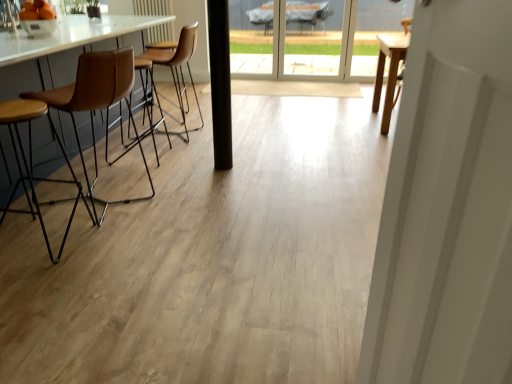
Question: Considering the relative sizes of transparent glass screen door at upper center and brown leather stool at left, positioned as the first chair in front-to-back order, in the image provided, is transparent glass screen door at upper center shorter than brown leather stool at left, positioned as the first chair in front-to-back order,?

Choices:
 (A) yes
 (B) no

Answer: (B)

Question: Is transparent glass screen door at upper center not within brown leather stool at left, positioned as the first chair in front-to-back order?

Choices:
 (A) no
 (B) yes

Answer: (B)

Question: Is the position of transparent glass screen door at upper center less distant than that of brown leather stool at left, which ranks as the 3th chair in back-to-front order?

Choices:
 (A) yes
 (B) no

Answer: (B)

Question: Does transparent glass screen door at upper center have a greater width compared to brown leather stool at left, which ranks as the 3th chair in back-to-front order?

Choices:
 (A) yes
 (B) no

Answer: (B)

Question: Is transparent glass screen door at upper center further to the viewer compared to brown leather stool at left, which ranks as the 3th chair in back-to-front order?

Choices:
 (A) no
 (B) yes

Answer: (B)

Question: From the image's perspective, is transparent glass screen door at upper center beneath brown leather stool at left, positioned as the first chair in front-to-back order?

Choices:
 (A) yes
 (B) no

Answer: (B)

Question: Is brown leather stool at left, positioned as the first chair in front-to-back order, facing towards transparent glass screen door at upper center?

Choices:
 (A) yes
 (B) no

Answer: (B)

Question: Can you confirm if brown leather stool at left, which ranks as the 3th chair in back-to-front order, is bigger than transparent glass screen door at upper center?

Choices:
 (A) no
 (B) yes

Answer: (B)

Question: Are brown leather stool at left, which ranks as the 3th chair in back-to-front order, and transparent glass screen door at upper center located far from each other?

Choices:
 (A) no
 (B) yes

Answer: (B)

Question: Considering the relative positions of brown leather stool at left, which ranks as the 3th chair in back-to-front order, and transparent glass screen door at upper center in the image provided, is brown leather stool at left, which ranks as the 3th chair in back-to-front order, to the right of transparent glass screen door at upper center from the viewer's perspective?

Choices:
 (A) yes
 (B) no

Answer: (B)

Question: Considering the relative sizes of brown leather stool at left, which ranks as the 3th chair in back-to-front order, and transparent glass screen door at upper center in the image provided, is brown leather stool at left, which ranks as the 3th chair in back-to-front order, thinner than transparent glass screen door at upper center?

Choices:
 (A) no
 (B) yes

Answer: (A)

Question: Can you confirm if brown leather stool at left, positioned as the first chair in front-to-back order, is taller than transparent glass screen door at upper center?

Choices:
 (A) yes
 (B) no

Answer: (B)

Question: Is transparent glass screen door at upper center far from brown leather stool at left, positioned as the second chair in front-to-back order?

Choices:
 (A) yes
 (B) no

Answer: (A)